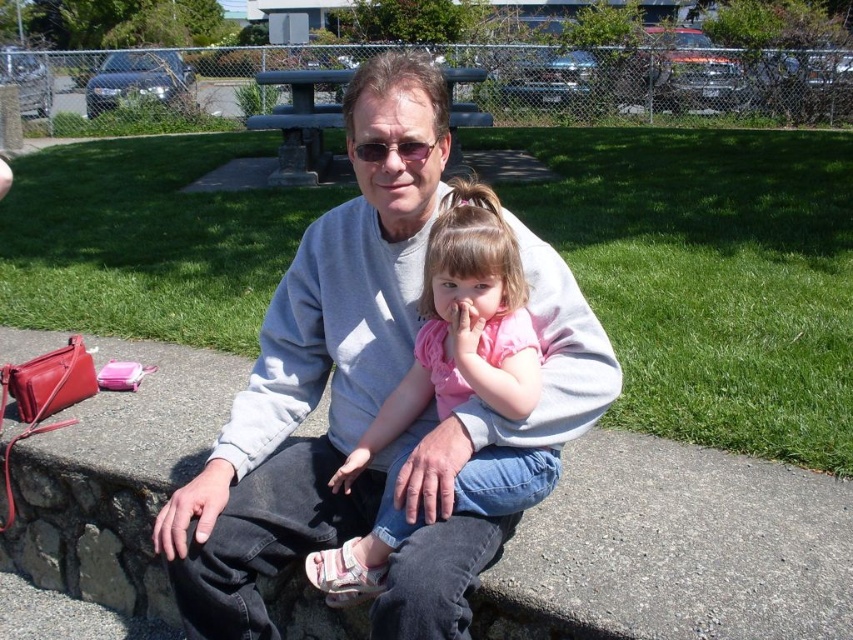
Can you confirm if pink fabric shirt at center is shorter than green concrete bench at center?

No, pink fabric shirt at center is not shorter than green concrete bench at center.

Who is shorter, pink fabric shirt at center or green concrete bench at center?

green concrete bench at center is shorter.

Who is more forward, (396,515) or (311,154)?

Positioned in front is point (396,515).

Where is `pink fabric shirt at center`? pink fabric shirt at center is located at coordinates (463, 324).

Which is below, gray sweatshirt at center or pink fabric shirt at center?

Positioned lower is pink fabric shirt at center.

Is gray sweatshirt at center smaller than pink fabric shirt at center?

Actually, gray sweatshirt at center might be larger than pink fabric shirt at center.

What do you see at coordinates (370, 394) in the screenshot? I see `gray sweatshirt at center` at bounding box center [370, 394].

Find the location of a particular element. The width and height of the screenshot is (853, 640). gray sweatshirt at center is located at coordinates (370, 394).

Does point (410, 259) come behind point (288, 118)?

No, it is not.

The width and height of the screenshot is (853, 640). Describe the element at coordinates (370, 394) in the screenshot. I see `gray sweatshirt at center` at that location.

Does point (357, 368) lie behind point (287, 164)?

That is False.

This screenshot has height=640, width=853. Find the location of `gray sweatshirt at center`. gray sweatshirt at center is located at coordinates (370, 394).